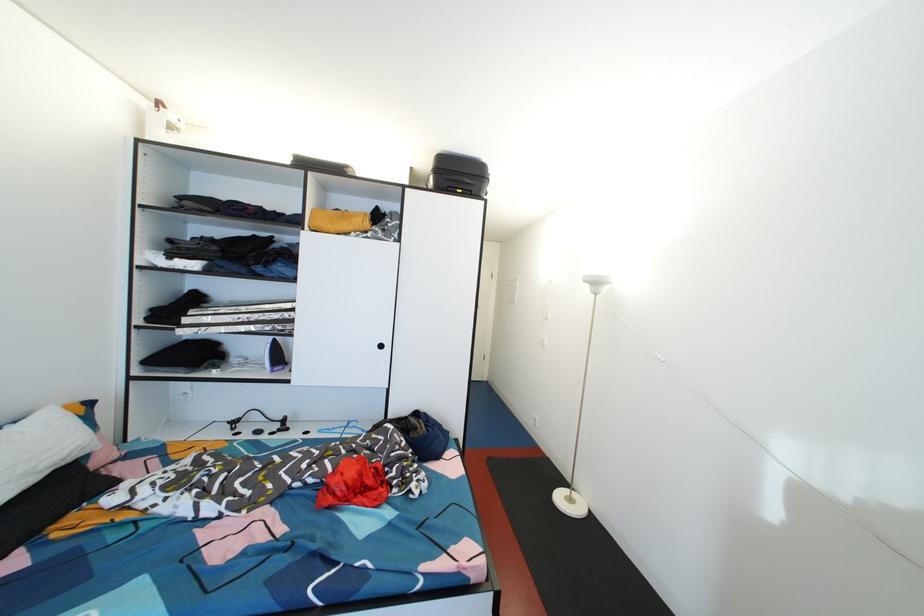
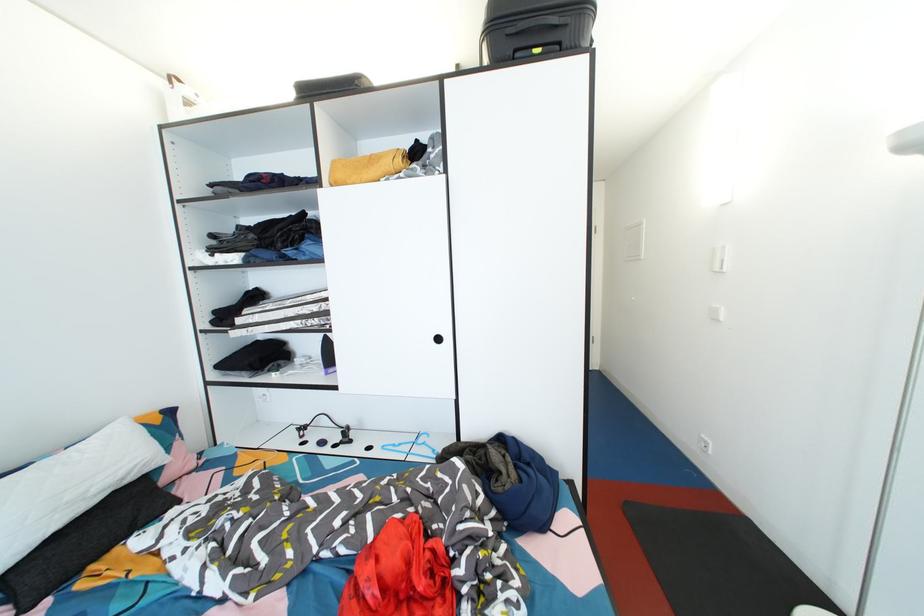
Find the pixel in the second image that matches the point at 73,458 in the first image.

(128, 477)